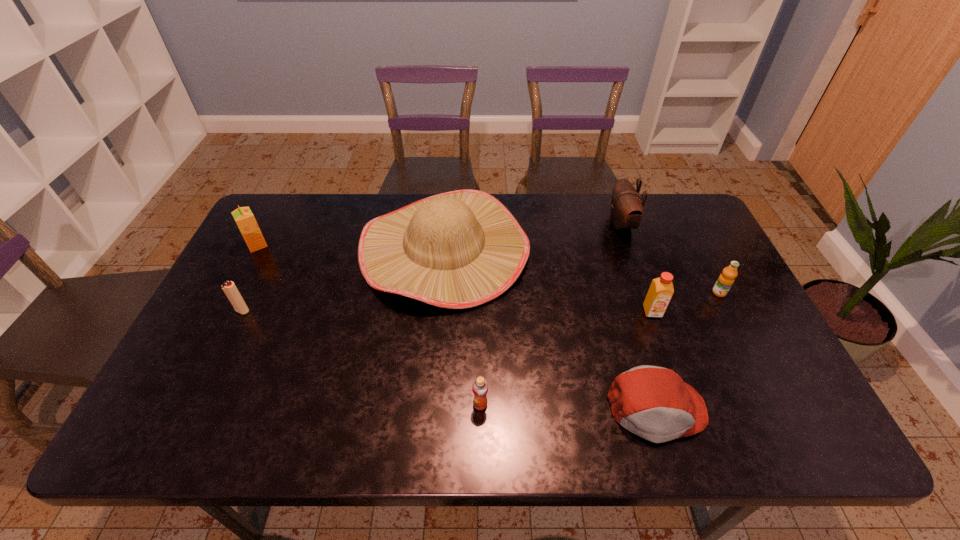
Locate which object is the fourth closest to the second orange juice from left to right. Please provide its 2D coordinates. Your answer should be formatted as a tuple, i.e. [(x, y)], where the tuple contains the x and y coordinates of a point satisfying the conditions above.

[(229, 288)]

Identify which object is the second closest to the cap. Please provide its 2D coordinates. Your answer should be formatted as a tuple, i.e. [(x, y)], where the tuple contains the x and y coordinates of a point satisfying the conditions above.

[(460, 249)]

You are a GUI agent. You are given a task and a screenshot of the screen. Output one action in this format:
    pyautogui.click(x=<x>, y=<y>)
    Task: Click on the third closest orange juice to the igniter
    
    Given the screenshot: What is the action you would take?
    pyautogui.click(x=661, y=289)

Where is `orange juice object that ranks as the second closest to the pouch`? orange juice object that ranks as the second closest to the pouch is located at coordinates click(x=661, y=289).

Locate an element on the screen. This screenshot has height=540, width=960. blank space that satisfies the following two spatial constraints: 1. with the flap open on the pouch; 2. on the front side of the leftmost orange juice is located at coordinates (628, 245).

Where is `vacant position in the image that satisfies the following two spatial constraints: 1. on the front side of the igniter; 2. on the right side of the second orange juice from left to right`? The width and height of the screenshot is (960, 540). vacant position in the image that satisfies the following two spatial constraints: 1. on the front side of the igniter; 2. on the right side of the second orange juice from left to right is located at coordinates (197, 404).

Find the location of a particular element. Image resolution: width=960 pixels, height=540 pixels. vacant space that satisfies the following two spatial constraints: 1. on the front side of the leftmost orange juice; 2. on the left side of the third orange juice from right to left is located at coordinates (174, 404).